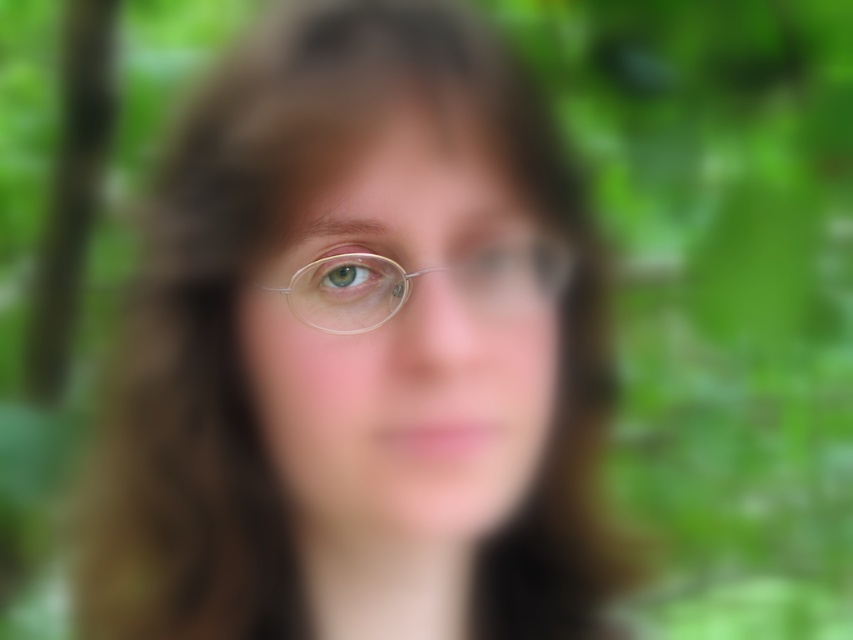
Is matte silver glasses at center taller than clear plastic glasses at center?

Indeed, matte silver glasses at center has a greater height compared to clear plastic glasses at center.

Measure the distance between matte silver glasses at center and camera.

They are 17.74 inches apart.

Identify the location of matte silver glasses at center. (409, 337).

Does matte gold glasses at center have a smaller size compared to matte silver glasses at center?

No, matte gold glasses at center is not smaller than matte silver glasses at center.

Between point (274, 321) and point (448, 104), which one is positioned behind?

Point (274, 321)

The width and height of the screenshot is (853, 640). In order to click on matte gold glasses at center in this screenshot , I will do `click(358, 355)`.

Does matte gold glasses at center appear on the left side of green matte eye at center?

No, matte gold glasses at center is not to the left of green matte eye at center.

Measure the distance between matte gold glasses at center and green matte eye at center.

matte gold glasses at center is 4.25 inches from green matte eye at center.

Where is `matte gold glasses at center`? The image size is (853, 640). matte gold glasses at center is located at coordinates (358, 355).